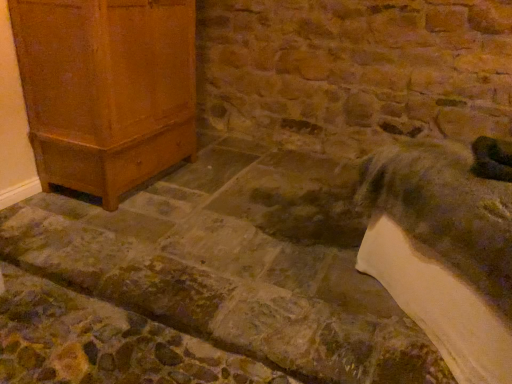
What do you see at coordinates (492, 158) in the screenshot? I see `green fuzzy animal at lower right` at bounding box center [492, 158].

Where is `green fuzzy animal at lower right`? green fuzzy animal at lower right is located at coordinates (492, 158).

Describe the element at coordinates (106, 90) in the screenshot. I see `matte wood cabinet at left` at that location.

The width and height of the screenshot is (512, 384). Find the location of `matte wood cabinet at left`. matte wood cabinet at left is located at coordinates (106, 90).

I want to click on green fuzzy animal at lower right, so click(492, 158).

Can you confirm if matte wood cabinet at left is positioned to the right of green fuzzy animal at lower right?

No.

Is matte wood cabinet at left further to the viewer compared to green fuzzy animal at lower right?

Yes.

Which is in front, point (178, 126) or point (505, 152)?

The point (505, 152) is closer.

From the image's perspective, which object appears higher, matte wood cabinet at left or green fuzzy animal at lower right?

matte wood cabinet at left.

From a real-world perspective, is matte wood cabinet at left physically located above or below green fuzzy animal at lower right?

From a real-world perspective, matte wood cabinet at left is physically below green fuzzy animal at lower right.

Is matte wood cabinet at left thinner than green fuzzy animal at lower right?

No.

Who is taller, matte wood cabinet at left or green fuzzy animal at lower right?

matte wood cabinet at left.

Considering the sizes of objects matte wood cabinet at left and green fuzzy animal at lower right in the image provided, who is bigger, matte wood cabinet at left or green fuzzy animal at lower right?

With larger size is matte wood cabinet at left.

From the picture: Is matte wood cabinet at left positioned beyond the bounds of green fuzzy animal at lower right?

Yes, matte wood cabinet at left is located beyond the bounds of green fuzzy animal at lower right.

Is the surface of matte wood cabinet at left in direct contact with green fuzzy animal at lower right?

No, matte wood cabinet at left is not next to green fuzzy animal at lower right.

Is matte wood cabinet at left turned away from green fuzzy animal at lower right?

No, matte wood cabinet at left's orientation is not away from green fuzzy animal at lower right.

Where is `animal in front of the matte wood cabinet at left`? animal in front of the matte wood cabinet at left is located at coordinates (492, 158).

Considering the relative positions of green fuzzy animal at lower right and matte wood cabinet at left in the image provided, is green fuzzy animal at lower right to the right of matte wood cabinet at left from the viewer's perspective?

Correct, you'll find green fuzzy animal at lower right to the right of matte wood cabinet at left.

Does green fuzzy animal at lower right lie in front of matte wood cabinet at left?

Yes, the depth of green fuzzy animal at lower right is less than that of matte wood cabinet at left.

Which is less distant, [500,176] or [85,168]?

The point [500,176] is closer.

From the image's perspective, is green fuzzy animal at lower right beneath matte wood cabinet at left?

Indeed, from the image's perspective, green fuzzy animal at lower right is shown beneath matte wood cabinet at left.

From a real-world perspective, who is located higher, green fuzzy animal at lower right or matte wood cabinet at left?

green fuzzy animal at lower right is physically above.

Considering the sizes of objects green fuzzy animal at lower right and matte wood cabinet at left in the image provided, who is thinner, green fuzzy animal at lower right or matte wood cabinet at left?

green fuzzy animal at lower right is thinner.

Is green fuzzy animal at lower right shorter than matte wood cabinet at left?

Yes, green fuzzy animal at lower right is shorter than matte wood cabinet at left.

Does green fuzzy animal at lower right have a smaller size compared to matte wood cabinet at left?

Yes, green fuzzy animal at lower right is smaller than matte wood cabinet at left.

Is green fuzzy animal at lower right spatially inside matte wood cabinet at left, or outside of it?

green fuzzy animal at lower right is spatially situated outside matte wood cabinet at left.

Are green fuzzy animal at lower right and matte wood cabinet at left making contact?

green fuzzy animal at lower right and matte wood cabinet at left are clearly separated.

Is green fuzzy animal at lower right aimed at matte wood cabinet at left?

No.

The image size is (512, 384). Identify the location of animal that is on the right side of matte wood cabinet at left. (492, 158).

Where is `furniture located above the green fuzzy animal at lower right (from the image's perspective)`? This screenshot has height=384, width=512. furniture located above the green fuzzy animal at lower right (from the image's perspective) is located at coordinates (106, 90).

I want to click on furniture located underneath the green fuzzy animal at lower right (from a real-world perspective), so click(x=106, y=90).